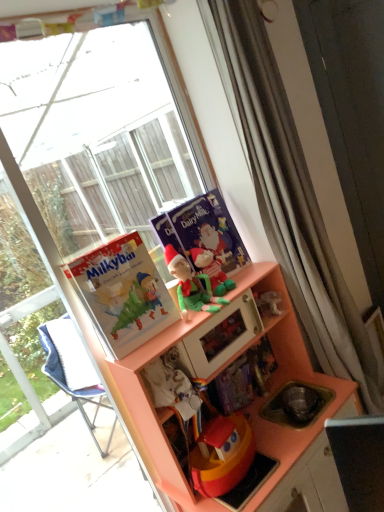
Question: Is matte purple comic book at center, positioned as the 1th comic book in back-to-front order, outside transparent glass window at upper left?

Choices:
 (A) no
 (B) yes

Answer: (B)

Question: Considering the relative sizes of matte purple comic book at center, which is the second comic book from front to back, and transparent glass window at upper left in the image provided, is matte purple comic book at center, which is the second comic book from front to back, wider than transparent glass window at upper left?

Choices:
 (A) no
 (B) yes

Answer: (A)

Question: From the image's perspective, would you say matte purple comic book at center, positioned as the 1th comic book in back-to-front order, is shown under transparent glass window at upper left?

Choices:
 (A) yes
 (B) no

Answer: (B)

Question: From the image's perspective, is matte purple comic book at center, positioned as the 1th comic book in back-to-front order, over transparent glass window at upper left?

Choices:
 (A) no
 (B) yes

Answer: (B)

Question: Is the depth of matte purple comic book at center, which is the second comic book from front to back, less than that of transparent glass window at upper left?

Choices:
 (A) no
 (B) yes

Answer: (A)

Question: Does matte purple comic book at center, positioned as the 1th comic book in back-to-front order, come behind transparent glass window at upper left?

Choices:
 (A) yes
 (B) no

Answer: (A)

Question: From the image's perspective, is white textured curtain at upper right over transparent glass window at upper left?

Choices:
 (A) no
 (B) yes

Answer: (B)

Question: Considering the relative sizes of white textured curtain at upper right and transparent glass window at upper left in the image provided, is white textured curtain at upper right thinner than transparent glass window at upper left?

Choices:
 (A) yes
 (B) no

Answer: (B)

Question: Can you confirm if white textured curtain at upper right is positioned to the right of transparent glass window at upper left?

Choices:
 (A) yes
 (B) no

Answer: (A)

Question: Is the position of white textured curtain at upper right more distant than that of transparent glass window at upper left?

Choices:
 (A) no
 (B) yes

Answer: (B)

Question: Is white textured curtain at upper right positioned in front of transparent glass window at upper left?

Choices:
 (A) no
 (B) yes

Answer: (A)

Question: Is transparent glass window at upper left completely or partially inside white textured curtain at upper right?

Choices:
 (A) no
 (B) yes

Answer: (A)

Question: Is green fabric elf at upper center looking in the opposite direction of transparent glass window at upper left?

Choices:
 (A) no
 (B) yes

Answer: (B)